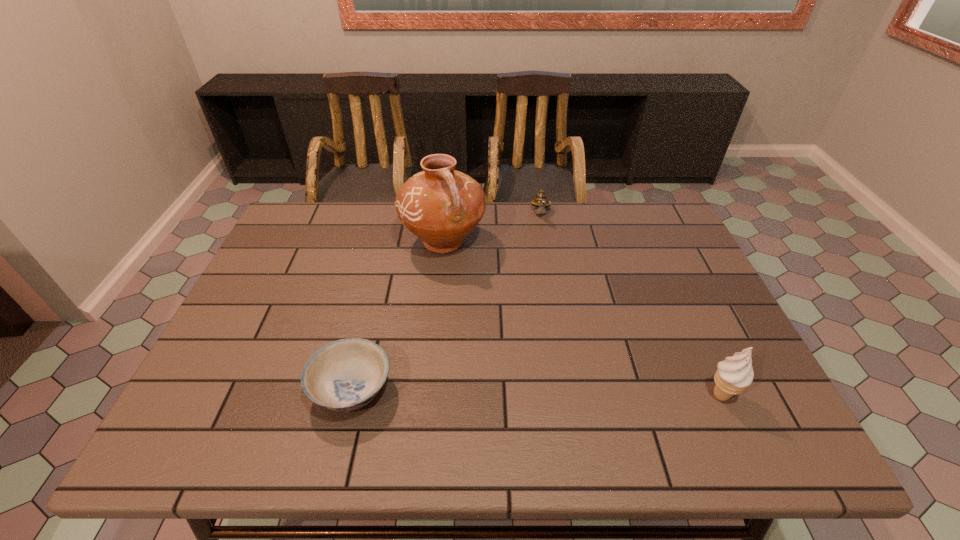
Find the location of a particular element. vacant space at the near edge of the desktop is located at coordinates (646, 382).

This screenshot has width=960, height=540. Identify the location of free space at the left edge of the desktop. (241, 350).

You are a GUI agent. You are given a task and a screenshot of the screen. Output one action in this format:
    pyautogui.click(x=<x>, y=<y>)
    Task: Click on the free location at the far left corner of the desktop
    
    Given the screenshot: What is the action you would take?
    pyautogui.click(x=301, y=239)

Locate an element on the screen. free spot at the far right corner of the desktop is located at coordinates (647, 237).

Image resolution: width=960 pixels, height=540 pixels. I want to click on free space at the near right corner, so click(731, 409).

You are a GUI agent. You are given a task and a screenshot of the screen. Output one action in this format:
    pyautogui.click(x=<x>, y=<y>)
    Task: Click on the vacant area that lies between the shortest object and the third shortest object
    The height and width of the screenshot is (540, 960).
    Given the screenshot: What is the action you would take?
    pyautogui.click(x=537, y=392)

The image size is (960, 540). I want to click on vacant point located between the third object from left to right and the tallest object, so click(492, 228).

Where is `free spot between the pottery and the snail`? The height and width of the screenshot is (540, 960). free spot between the pottery and the snail is located at coordinates (492, 228).

I want to click on vacant point located between the pottery and the shortest object, so click(398, 315).

Identify the location of vacant area between the pottery and the second object from right to left. (492, 228).